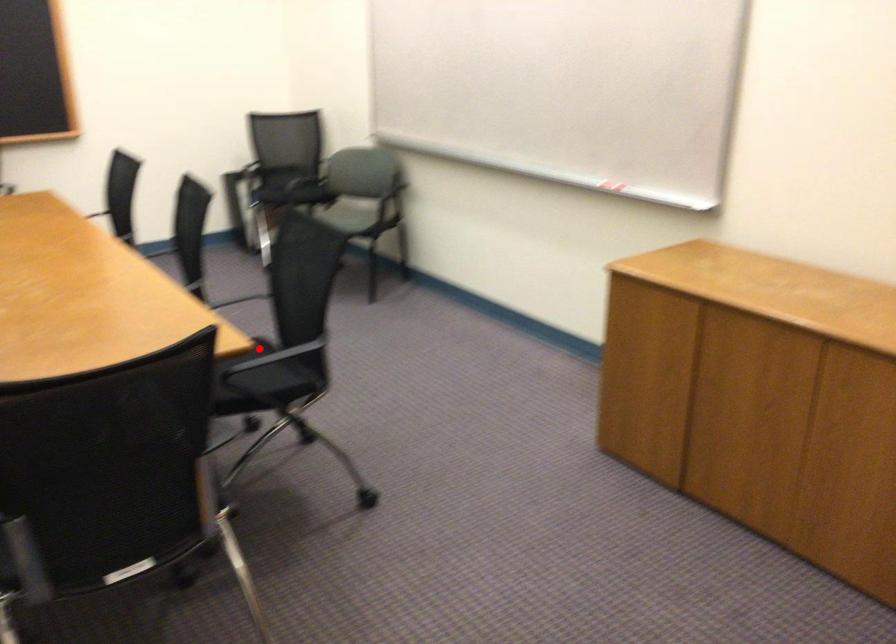
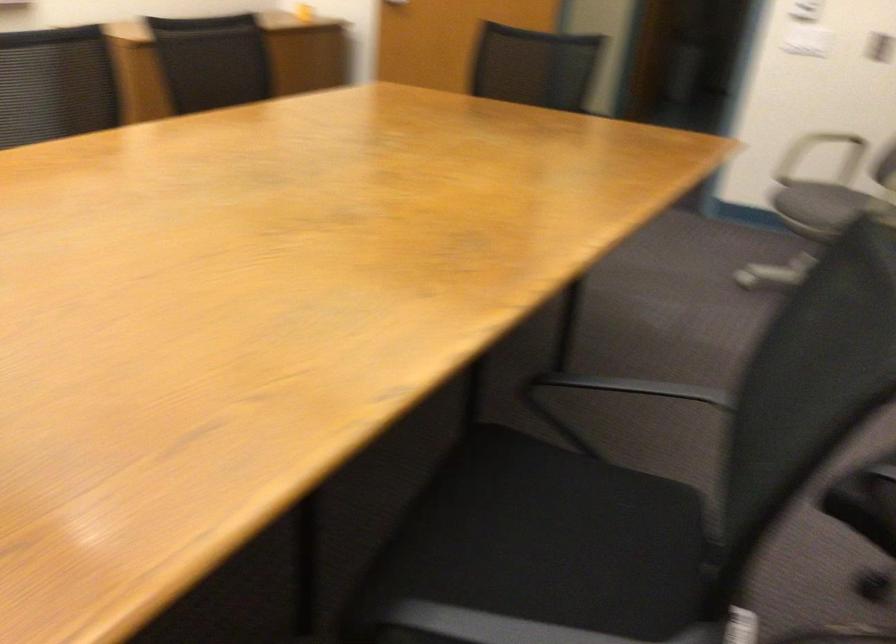
Question: I am providing you with two images of the same scene from different viewpoints. A red point is marked on the first image. Is the red point's position out of view in image 2?

Choices:
 (A) Yes
 (B) No

Answer: (A)